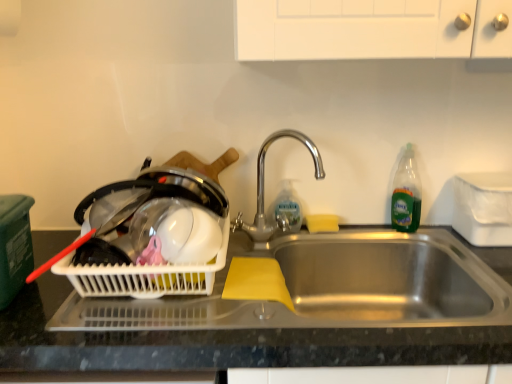
I want to click on vacant area to the left of yellow sponge at sink, so click(280, 237).